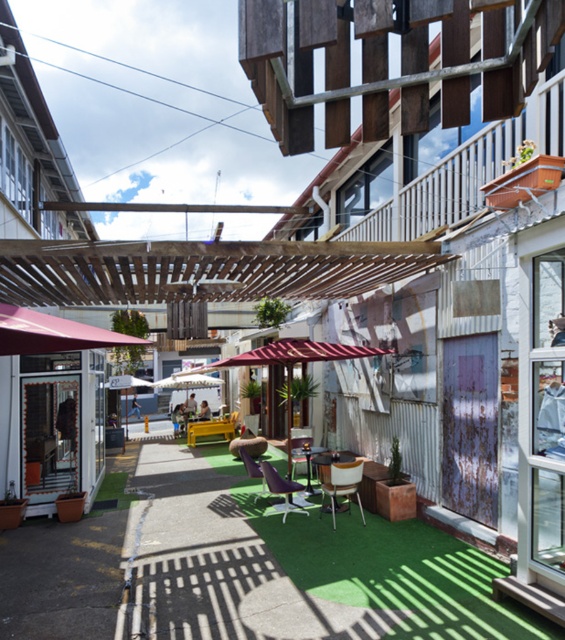
You are standing at the entrance of the alleyway and want to place a new round table on the green artificial turf at center. Based on the coordinates provided, is the point marked as point [393,572] the correct location for the table?

Yes, the point [393,572] marks the green artificial turf at center, so placing the table there would be correct.

You are a customer at the outdoor seating area and want to place your large backpack between the green artificial turf at center and the purple fabric chair at center. Can you fit it there?

The green artificial turf at center might be wider than purple fabric chair at center, so there could be enough space to fit the backpack between them.

You are a customer sitting on the metallic silver chair at center. You want to place your drink on the green artificial turf at center. Can you reach it without moving your chair?

The green artificial turf at center is in front of the metallic silver chair at center, so you can reach it by extending your arm forward since the turf is directly in front of you.